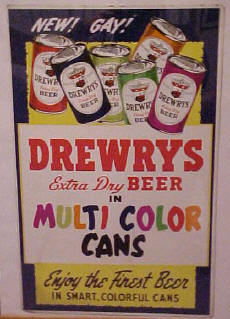
This screenshot has height=319, width=230. I want to click on frame of photo, so point(215,248), point(3,240), point(11,303).